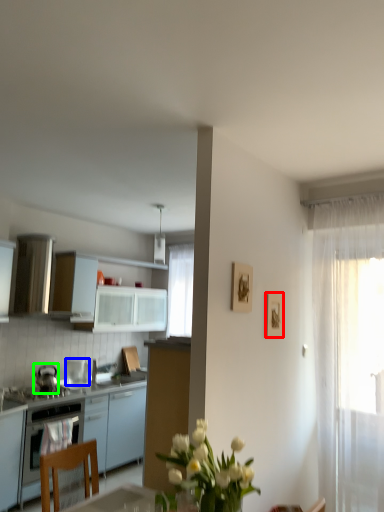
Question: Based on their relative distances, which object is farther from picture frame (highlighted by a red box)? Choose from kitchen appliance (highlighted by a blue box) and kitchen appliance (highlighted by a green box).

Choices:
 (A) kitchen appliance
 (B) kitchen appliance

Answer: (A)